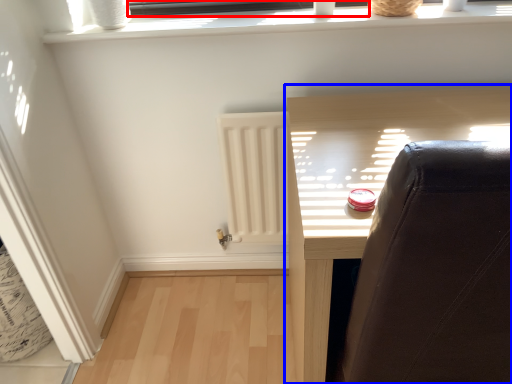
Question: Which of the following is the closest to the observer, window frame (highlighted by a red box) or furniture (highlighted by a blue box)?

Choices:
 (A) window frame
 (B) furniture

Answer: (B)